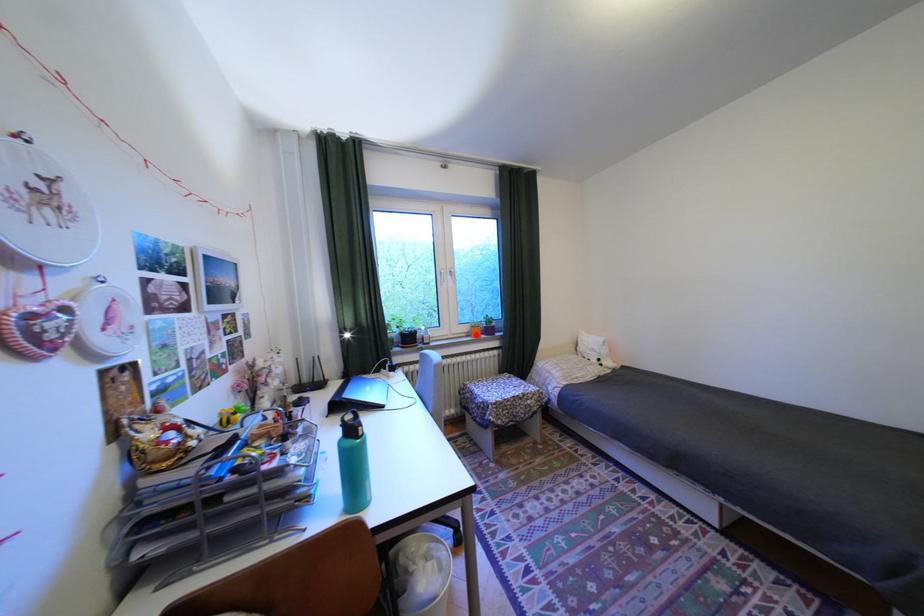
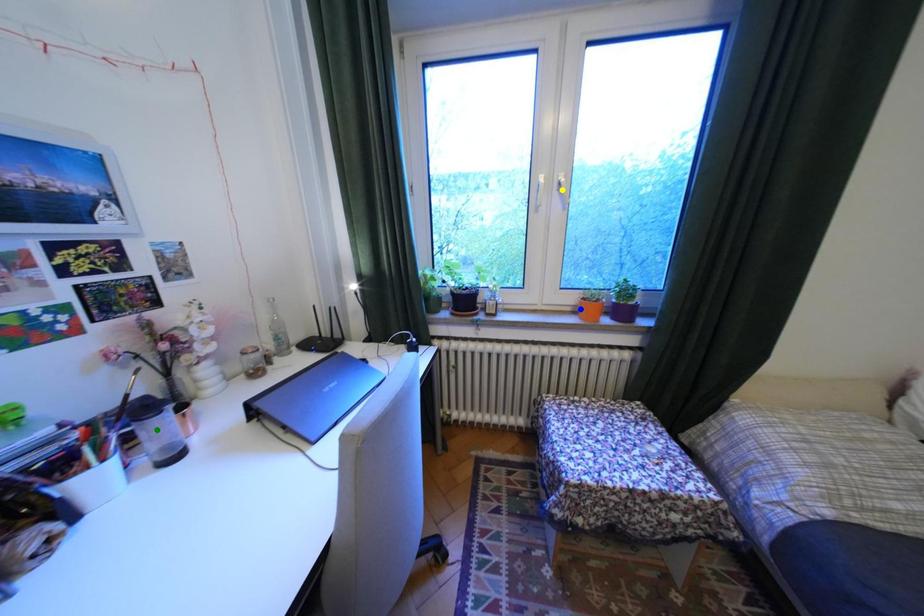
Question: I am providing you with two images of the same scene from different viewpoints. A red point is marked on the first image. You are given multiple points on the second image. Which point in image 2 represents the same 3d spot as the red point in image 1?

Choices:
 (A) green point
 (B) blue point
 (C) yellow point

Answer: (B)